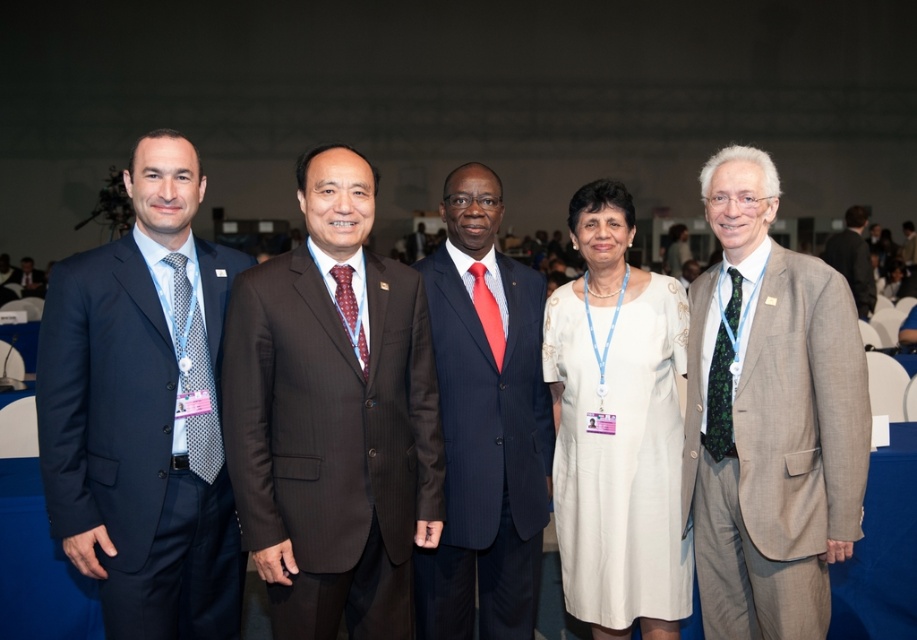
Question: Can you confirm if dark brown suit at right is positioned to the left of dark brown suit at center?

Choices:
 (A) yes
 (B) no

Answer: (B)

Question: Is matte black suit at left closer to camera compared to dark brown suit at center?

Choices:
 (A) yes
 (B) no

Answer: (A)

Question: Which point is farther to the camera?

Choices:
 (A) (413, 257)
 (B) (153, 369)
 (C) (271, 269)
 (D) (436, 285)

Answer: (A)

Question: Which point is farther from the camera taking this photo?

Choices:
 (A) (605, 464)
 (B) (846, 280)
 (C) (736, 636)

Answer: (B)

Question: Does dark blue pinstripe suit at center appear over dark brown suit at right?

Choices:
 (A) no
 (B) yes

Answer: (A)

Question: Which object appears closest to the camera in this image?

Choices:
 (A) dark brown suit at center
 (B) light brown wool suit at right
 (C) white satin dress at center
 (D) navy blue suit at left

Answer: (D)